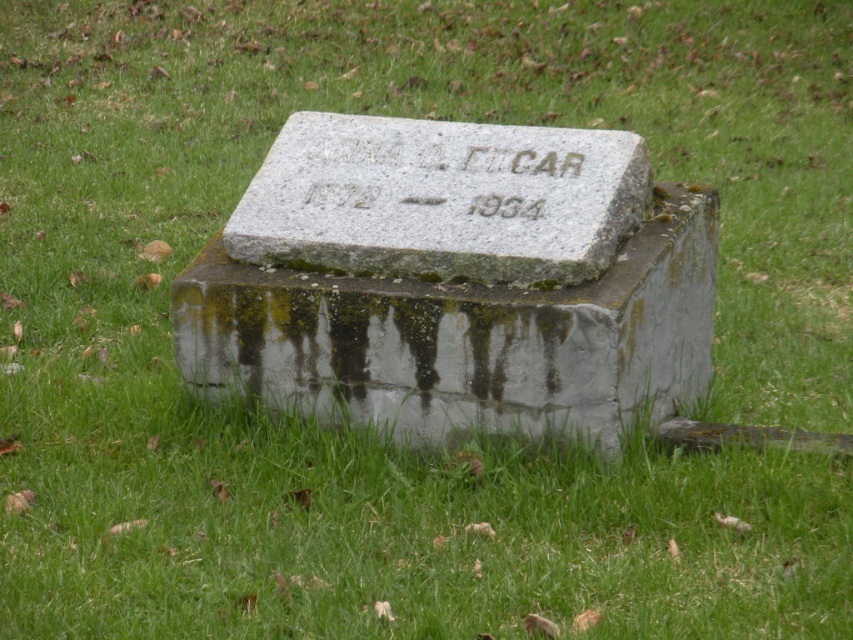
You are a surveyor measuring distances between landmarks. You have two markers in front of you, the gray stone marker at center and the etched granite stone at center. According to your measurements, are they the same object or different objects?

The gray stone marker at center is 1.70 inches away from the etched granite stone at center, so they are different objects.

You are a gardener who needs to place a new flower pot between the gray stone gravestone at center and the gray stone marker at center. The flower pot has a diameter of 10 inches. Will there be enough space between them to place the flower pot?

The gray stone gravestone at center and the gray stone marker at center are 10.56 inches apart. Since the flower pot has a diameter of 10 inches, there is enough space between them to place the flower pot as the distance between them is slightly larger than the pot.

You are standing in front of the weathered stone marker and want to touch the two points mentioned. Which point, point (657, 282) or point (317, 141), will you reach first if you move towards them?

Point (657, 282) is closer to the camera than point (317, 141), so you will reach point (657, 282) first.